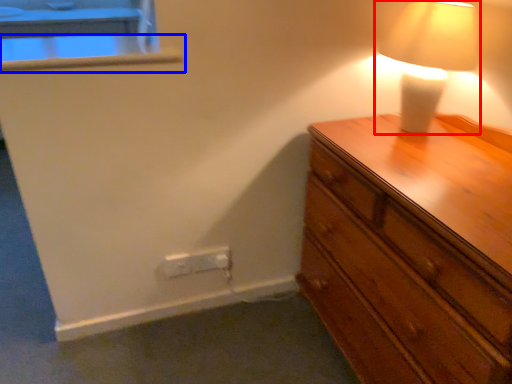
Question: Which point is further to the camera, lamp (highlighted by a red box) or window sill (highlighted by a blue box)?

Choices:
 (A) lamp
 (B) window sill

Answer: (B)